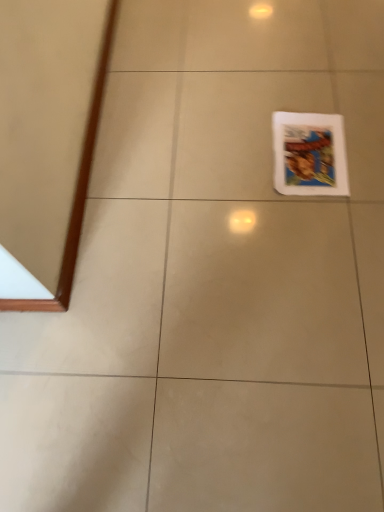
Describe the element at coordinates (309, 154) in the screenshot. I see `white matte picture frame at lower right` at that location.

Where is `white matte picture frame at lower right`? white matte picture frame at lower right is located at coordinates (309, 154).

What is the approximate width of white matte picture frame at lower right?

white matte picture frame at lower right is 12.45 inches in width.

Locate an element on the screen. This screenshot has height=512, width=384. white matte picture frame at lower right is located at coordinates (309, 154).